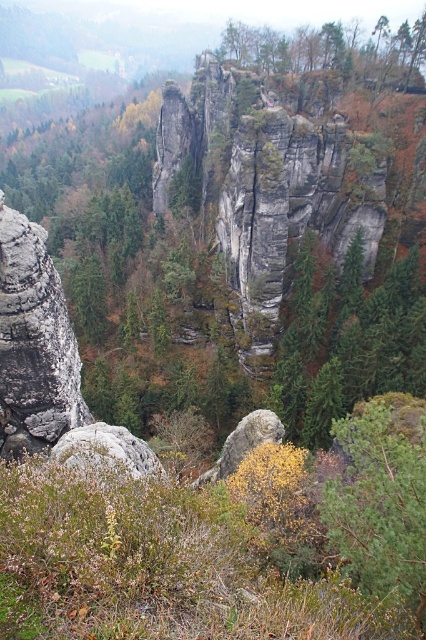
You are standing at the base of the massive cliff face and want to take a photo of the green matte tree at center. Based on its coordinates, is the tree positioned to the left or right of the cliff?

The green matte tree at center is located at point coordinates, so it is positioned to the right of the cliff face.